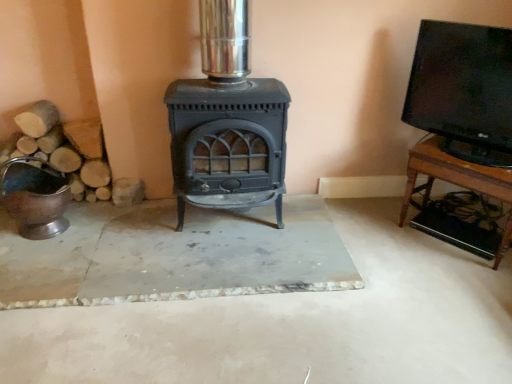
I want to click on vacant area to the right of matte black wood burning stove at center, so click(x=308, y=226).